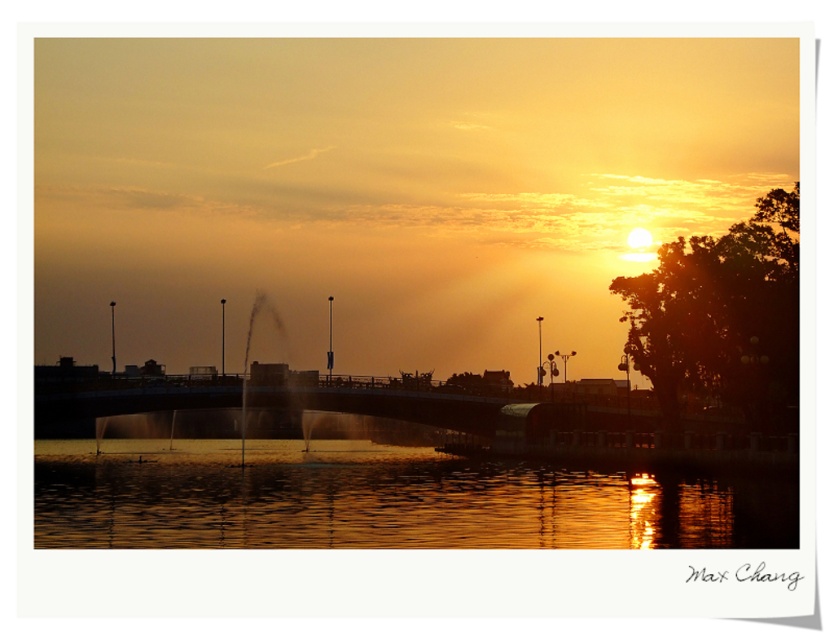
Can you confirm if shiny reflective water at center is positioned below metallic bridge at center?

Correct, shiny reflective water at center is located below metallic bridge at center.

Is shiny reflective water at center smaller than metallic bridge at center?

Yes, shiny reflective water at center is smaller than metallic bridge at center.

I want to click on shiny reflective water at center, so click(390, 499).

Locate an element on the screen. The image size is (834, 640). shiny reflective water at center is located at coordinates (390, 499).